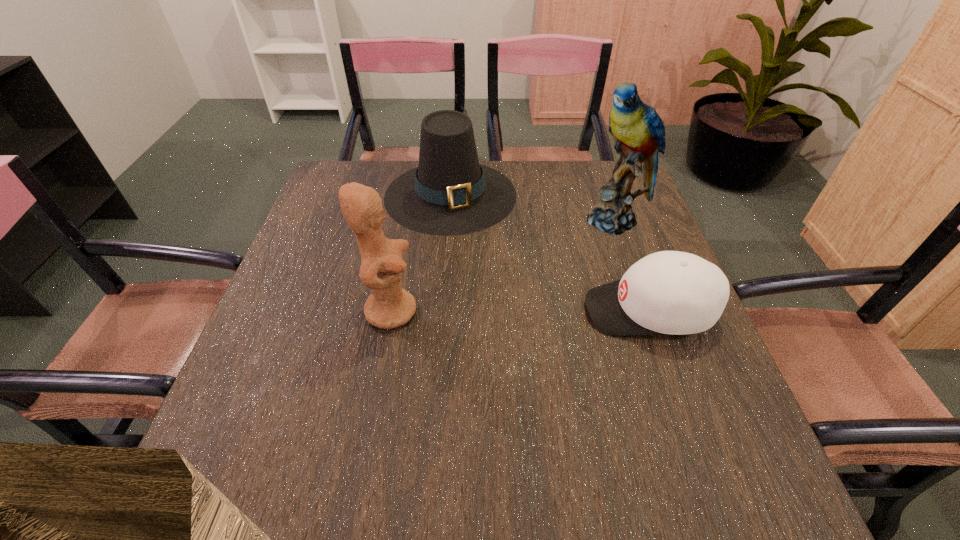
Identify the location of the third shortest object. (390, 306).

Locate an element on the screen. The image size is (960, 540). baseball cap is located at coordinates (669, 292).

Find the location of a particular element. The image size is (960, 540). the tallest object is located at coordinates (638, 131).

At what (x,y) coordinates should I click in order to perform the action: click on hat. Please return your answer as a coordinate pair (x, y). This screenshot has width=960, height=540. Looking at the image, I should click on (449, 193).

This screenshot has width=960, height=540. Find the location of `vacant space located 0.080m on the front-facing side of the second tallest object`. vacant space located 0.080m on the front-facing side of the second tallest object is located at coordinates (454, 310).

The width and height of the screenshot is (960, 540). I want to click on vacant area situated 0.360m on the front-facing side of the shortest object, so click(420, 310).

Locate an element on the screen. vacant space situated on the front-facing side of the shortest object is located at coordinates (507, 310).

Identify the location of blank space located 0.350m on the front-facing side of the shortest object. The width and height of the screenshot is (960, 540). (424, 310).

You are a GUI agent. You are given a task and a screenshot of the screen. Output one action in this format:
    pyautogui.click(x=<x>, y=<y>)
    Task: Click on the vacant space situated 0.140m on the face of the parrot
    The width and height of the screenshot is (960, 540).
    Given the screenshot: What is the action you would take?
    pyautogui.click(x=579, y=264)

The image size is (960, 540). I want to click on vacant space located on the face of the parrot, so click(589, 251).